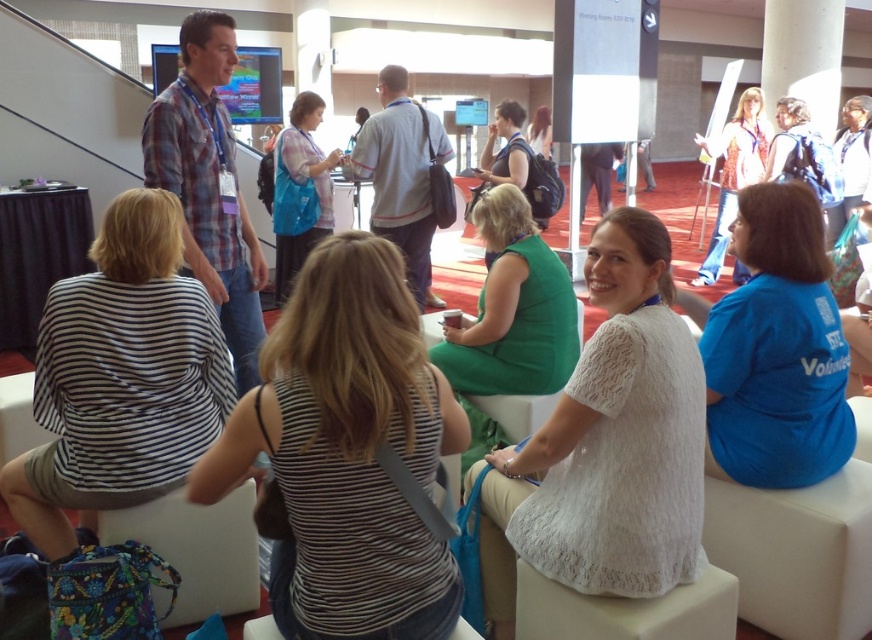
Question: Where is white lace dress at center located in relation to blue cotton shirt at right in the image?

Choices:
 (A) below
 (B) above

Answer: (A)

Question: Where is striped fabric tank top at center located in relation to matte blue backpack at center in the image?

Choices:
 (A) left
 (B) right

Answer: (B)

Question: Does striped fabric shirt at left appear on the right side of white shirt at upper right?

Choices:
 (A) yes
 (B) no

Answer: (B)

Question: Which of the following is the closest to the observer?

Choices:
 (A) (663, 544)
 (B) (771, 420)
 (C) (298, 163)

Answer: (A)

Question: Which point is closer to the camera taking this photo?

Choices:
 (A) (511, 186)
 (B) (712, 246)
 (C) (305, 125)

Answer: (A)

Question: Estimate the real-world distances between objects in this image. Which object is closer to the striped fabric shirt at left?

Choices:
 (A) white shirt at upper right
 (B) green fabric dress at center
 (C) matte blue backpack at center
 (D) blue cotton shirt at right

Answer: (B)